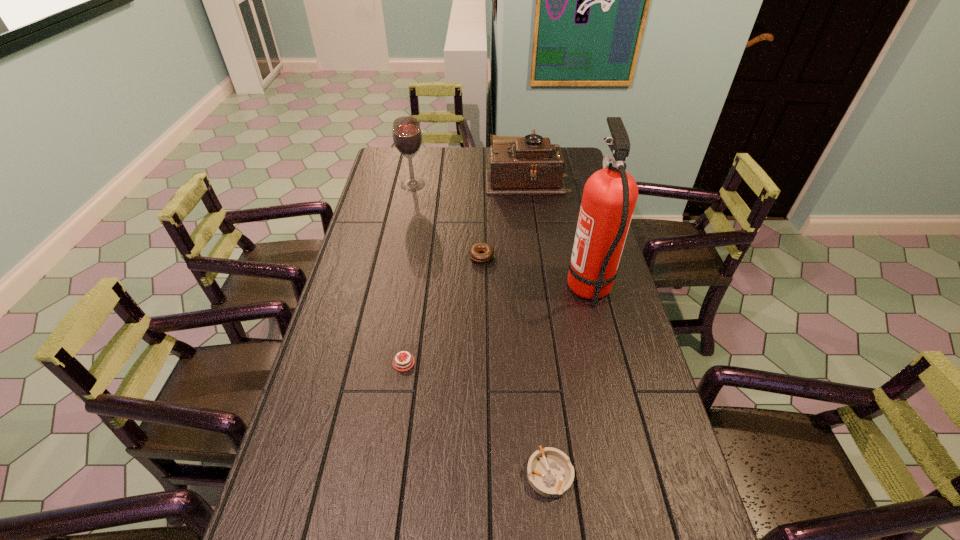
Locate an element on the screen. This screenshot has height=540, width=960. vacant region located 0.260m on the horn of the fourth shortest object is located at coordinates (426, 179).

In order to click on vacant space located on the horn of the fourth shortest object in this screenshot , I will do `click(456, 179)`.

In order to click on vacant space situated on the horn of the fourth shortest object in this screenshot , I will do `click(443, 179)`.

Where is `vacant area situated 0.320m on the back of the doughnut`? This screenshot has height=540, width=960. vacant area situated 0.320m on the back of the doughnut is located at coordinates (481, 198).

The height and width of the screenshot is (540, 960). Find the location of `vacant position located on the back of the chocolate cake`. vacant position located on the back of the chocolate cake is located at coordinates (420, 254).

What are the coordinates of `free spot located on the front of the nearest object` in the screenshot? It's located at (557, 539).

Locate an element on the screen. object that is positioned at the far edge is located at coordinates [531, 165].

Locate an element on the screen. The image size is (960, 540). object that is at the left edge is located at coordinates (407, 136).

Image resolution: width=960 pixels, height=540 pixels. What are the coordinates of `fire extinguisher present at the right edge` in the screenshot? It's located at (610, 194).

Where is `phonograph_record at the right edge`? Image resolution: width=960 pixels, height=540 pixels. phonograph_record at the right edge is located at coordinates (531, 165).